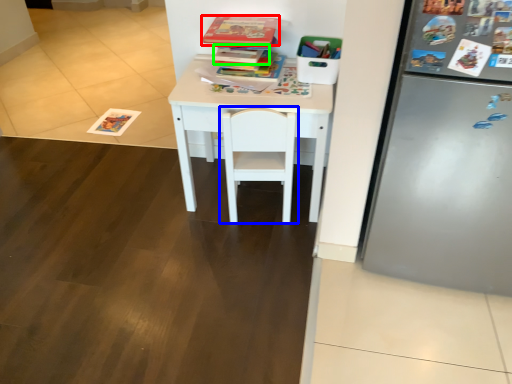
Question: Based on their relative distances, which object is farther from book (highlighted by a red box)? Choose from chair (highlighted by a blue box) and book (highlighted by a green box).

Choices:
 (A) chair
 (B) book

Answer: (A)